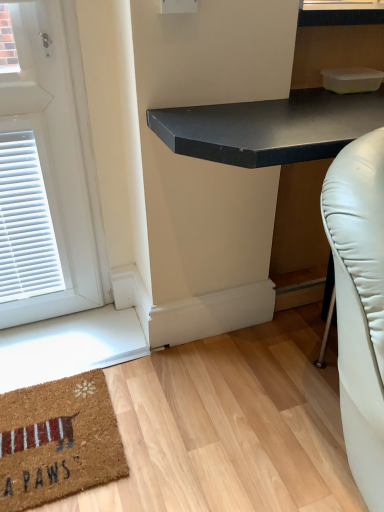
Question: Considering the relative sizes of black matte desk at center and brown coir mat at lower left in the image provided, is black matte desk at center wider than brown coir mat at lower left?

Choices:
 (A) yes
 (B) no

Answer: (A)

Question: Is black matte desk at center bigger than brown coir mat at lower left?

Choices:
 (A) no
 (B) yes

Answer: (B)

Question: Considering the relative sizes of black matte desk at center and brown coir mat at lower left in the image provided, is black matte desk at center thinner than brown coir mat at lower left?

Choices:
 (A) no
 (B) yes

Answer: (A)

Question: From a real-world perspective, is black matte desk at center on brown coir mat at lower left?

Choices:
 (A) yes
 (B) no

Answer: (A)

Question: Is black matte desk at center located outside brown coir mat at lower left?

Choices:
 (A) yes
 (B) no

Answer: (A)

Question: From a real-world perspective, is black matte desk at center below brown coir mat at lower left?

Choices:
 (A) no
 (B) yes

Answer: (A)

Question: Can you confirm if brown coir mat at lower left is thinner than black matte desk at center?

Choices:
 (A) no
 (B) yes

Answer: (B)

Question: From the image's perspective, is brown coir mat at lower left above black matte desk at center?

Choices:
 (A) yes
 (B) no

Answer: (B)

Question: From the image's perspective, does brown coir mat at lower left appear lower than black matte desk at center?

Choices:
 (A) yes
 (B) no

Answer: (A)

Question: Does brown coir mat at lower left turn towards black matte desk at center?

Choices:
 (A) yes
 (B) no

Answer: (B)

Question: Considering the relative sizes of brown coir mat at lower left and black matte desk at center in the image provided, is brown coir mat at lower left taller than black matte desk at center?

Choices:
 (A) no
 (B) yes

Answer: (A)

Question: Does brown coir mat at lower left touch black matte desk at center?

Choices:
 (A) yes
 (B) no

Answer: (B)

Question: Is black matte desk at center taller or shorter than brown coir mat at lower left?

Choices:
 (A) tall
 (B) short

Answer: (A)